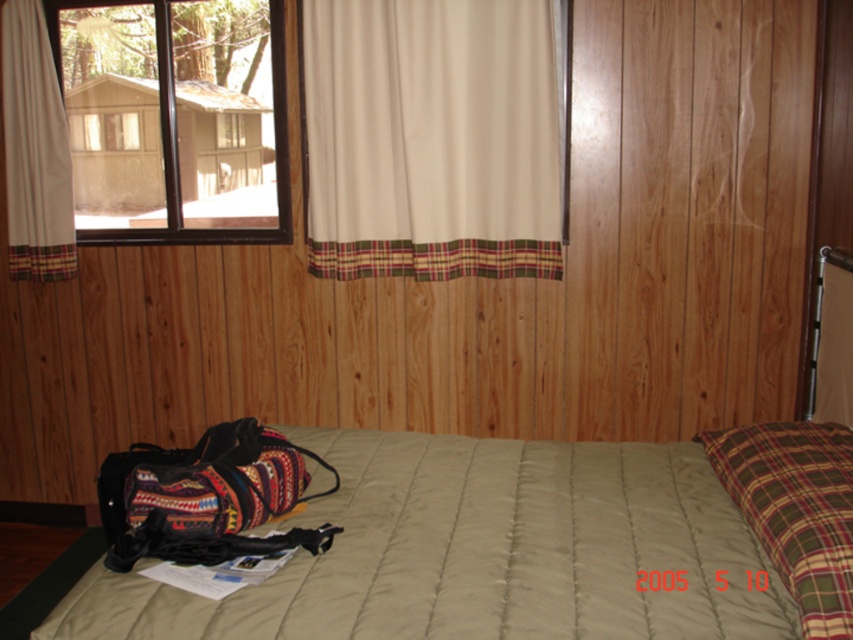
In the scene shown: You are organizing the items in the bedroom and need to place the multicolored woven duffel at lower left and the white fabric curtain at upper left. Which object has a greater width?

The multicolored woven duffel at lower left has a greater width than the white fabric curtain at upper left.

You are standing in the bedroom and want to know how far the point at coordinates point (416,49) is from you. Can you determine the distance?

The distance of point (416,49) from viewer is 8.09 feet.